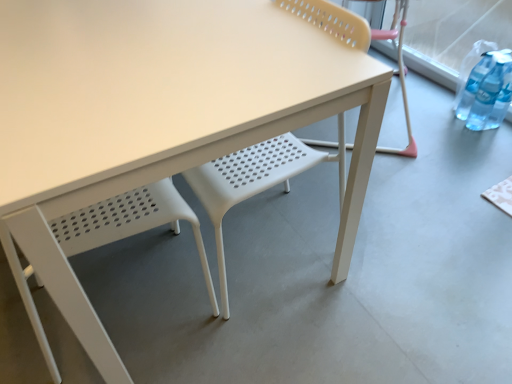
What are the coordinates of `vacant area that is in front of matte plastic chair at right, positioned as the second chair in front-to-back order` in the screenshot? It's located at (417, 185).